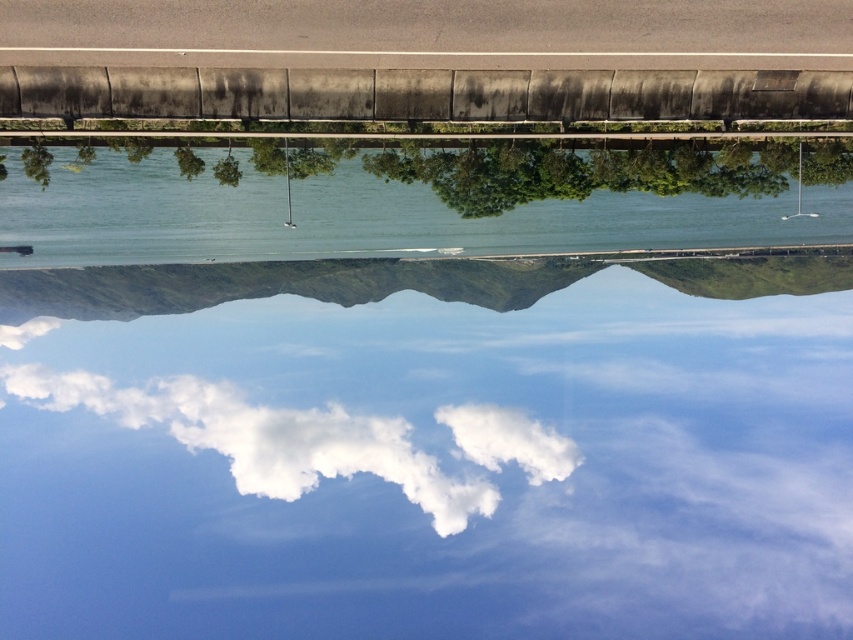
Question: Is clear water at center positioned behind white fluffy cloud at center?

Choices:
 (A) no
 (B) yes

Answer: (A)

Question: Among these objects, which one is nearest to the camera?

Choices:
 (A) white fluffy cloud at center
 (B) clear water at center

Answer: (B)

Question: Which point appears closest to the camera in this image?

Choices:
 (A) (268, 246)
 (B) (184, 445)

Answer: (A)

Question: Which of the following is the closest to the observer?

Choices:
 (A) white fluffy cloud at center
 (B) clear water at center

Answer: (B)

Question: Does clear water at center appear over white fluffy cloud at center?

Choices:
 (A) no
 (B) yes

Answer: (B)

Question: Does clear water at center appear over white fluffy cloud at center?

Choices:
 (A) no
 (B) yes

Answer: (B)